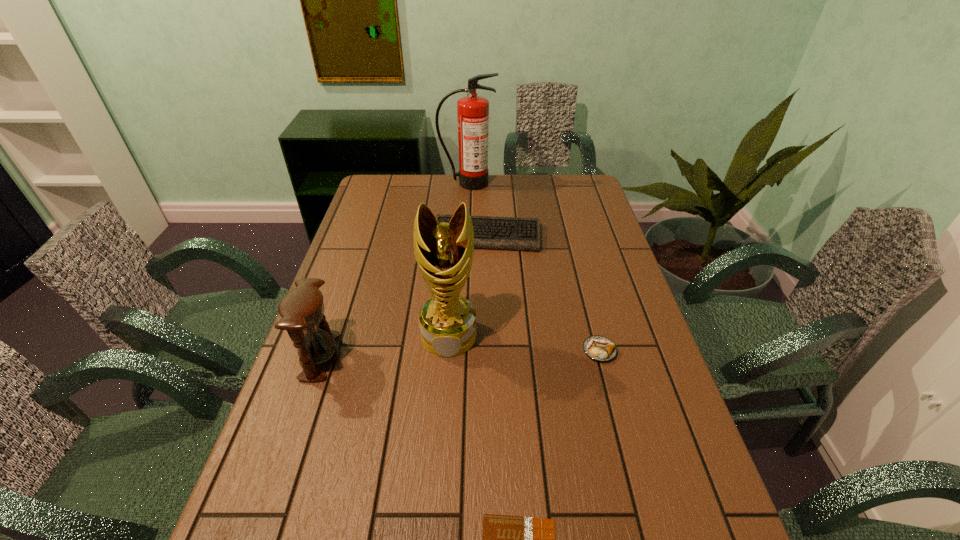
At what (x,y) coordinates should I click in order to perform the action: click on free area in between the third shortest object and the farthest object. Please return your answer as a coordinate pair (x, y). Looking at the image, I should click on (477, 210).

Identify which object is the closest to the computer keyboard. Please provide its 2D coordinates. Your answer should be formatted as a tuple, i.e. [(x, y)], where the tuple contains the x and y coordinates of a point satisfying the conditions above.

[(472, 111)]

Find the location of `object identified as the closest to the fifth nearest object`. object identified as the closest to the fifth nearest object is located at coordinates (472, 111).

Locate an element on the screen. The width and height of the screenshot is (960, 540). free space that satisfies the following two spatial constraints: 1. on the front-facing side of the farthest object; 2. on the left side of the rightmost object is located at coordinates (460, 350).

I want to click on free location that satisfies the following two spatial constraints: 1. on the front side of the second farthest object; 2. on the left side of the fifth tallest object, so click(x=489, y=350).